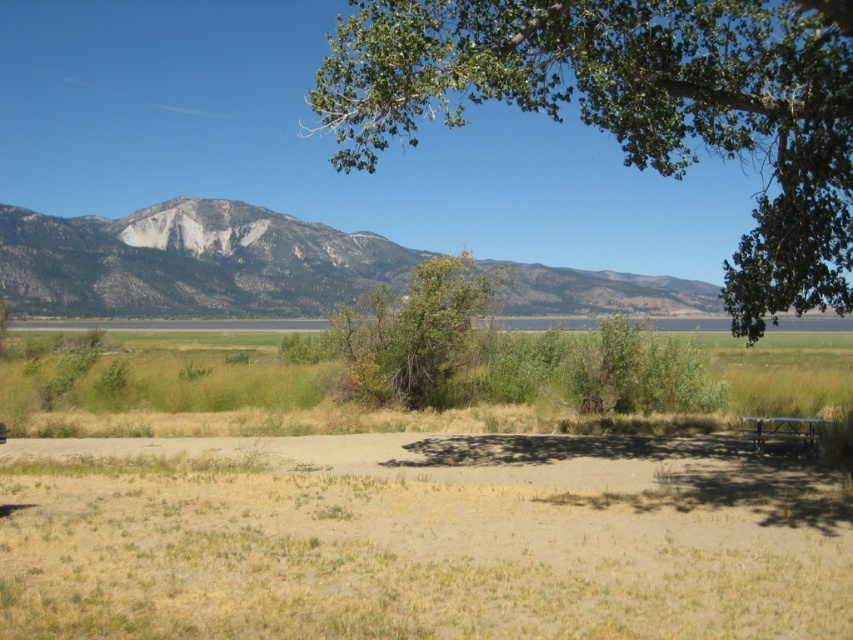
You are standing at the point marked by the coordinates point at (190, 260) in the image. What is the name of the geographical feature you are currently standing on?

You are standing on the rocky gray mountain at center, as the point at (190, 260) represents this feature.

You are planning to set up a picnic table in this landscape. Based on the image, can you determine if the metallic silver picnic table at lower right is positioned in front of or behind the rocky gray mountain at center?

The metallic silver picnic table at lower right is behind the rocky gray mountain at center according to the description.

You are planning to take a photo of the rocky gray mountain at center and the metallic silver picnic table at lower right. Which object should you focus on first if you want to capture both in the same frame without moving the camera?

The rocky gray mountain at center is much taller than the metallic silver picnic table at lower right, so you should focus on the metallic silver picnic table at lower right first to ensure both are in focus.